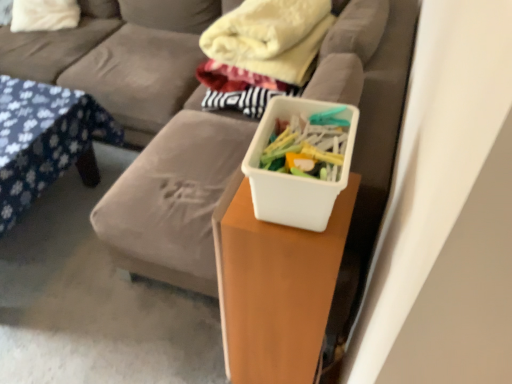
Question: Considering the relative sizes of white matte plastic container at center and white soft pillow at upper left in the image provided, is white matte plastic container at center wider than white soft pillow at upper left?

Choices:
 (A) yes
 (B) no

Answer: (B)

Question: From the image's perspective, is white matte plastic container at center beneath white soft pillow at upper left?

Choices:
 (A) yes
 (B) no

Answer: (A)

Question: Is white matte plastic container at center positioned with its back to white soft pillow at upper left?

Choices:
 (A) no
 (B) yes

Answer: (A)

Question: Is white matte plastic container at center shorter than white soft pillow at upper left?

Choices:
 (A) yes
 (B) no

Answer: (B)

Question: Is white matte plastic container at center completely or partially outside of white soft pillow at upper left?

Choices:
 (A) yes
 (B) no

Answer: (A)

Question: Considering the positions of white plastic container at center and white soft pillow at upper left in the image, is white plastic container at center wider or thinner than white soft pillow at upper left?

Choices:
 (A) wide
 (B) thin

Answer: (B)

Question: Is white plastic container at center in front of or behind white soft pillow at upper left in the image?

Choices:
 (A) front
 (B) behind

Answer: (A)

Question: From a real-world perspective, relative to white soft pillow at upper left, is white plastic container at center vertically above or below?

Choices:
 (A) above
 (B) below

Answer: (A)

Question: Is point (256, 182) closer or farther from the camera than point (76, 14)?

Choices:
 (A) farther
 (B) closer

Answer: (B)

Question: Considering the positions of soft gray couch at center and blue floral fabric at left in the image, is soft gray couch at center taller or shorter than blue floral fabric at left?

Choices:
 (A) short
 (B) tall

Answer: (B)

Question: Is soft gray couch at center in front of or behind blue floral fabric at left in the image?

Choices:
 (A) front
 (B) behind

Answer: (B)

Question: Considering the positions of point (96, 69) and point (23, 157), is point (96, 69) closer or farther from the camera than point (23, 157)?

Choices:
 (A) farther
 (B) closer

Answer: (A)

Question: Would you say soft gray couch at center is inside or outside blue floral fabric at left?

Choices:
 (A) outside
 (B) inside

Answer: (A)

Question: Is soft gray couch at center wider or thinner than white soft pillow at upper left?

Choices:
 (A) thin
 (B) wide

Answer: (B)

Question: Considering the positions of soft gray couch at center and white soft pillow at upper left in the image, is soft gray couch at center taller or shorter than white soft pillow at upper left?

Choices:
 (A) tall
 (B) short

Answer: (A)